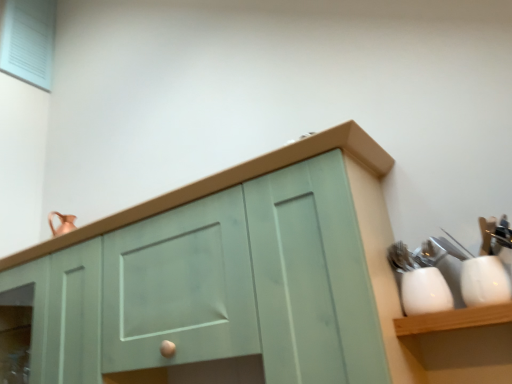
Question: Can you confirm if matte green cabinet at center is taller than white glossy cup at right, which appears as the second tableware when viewed from the right?

Choices:
 (A) no
 (B) yes

Answer: (B)

Question: Is matte green cabinet at center in contact with white glossy cup at right, arranged as the first tableware when viewed from the left?

Choices:
 (A) yes
 (B) no

Answer: (B)

Question: Is matte green cabinet at center far away from white glossy cup at right, which appears as the second tableware when viewed from the right?

Choices:
 (A) yes
 (B) no

Answer: (B)

Question: Is matte green cabinet at center at the right side of white glossy cup at right, arranged as the first tableware when viewed from the left?

Choices:
 (A) no
 (B) yes

Answer: (A)

Question: From the image's perspective, does matte green cabinet at center appear lower than white glossy cup at right, arranged as the first tableware when viewed from the left?

Choices:
 (A) no
 (B) yes

Answer: (B)

Question: From a real-world perspective, is matte green cabinet at center under white glossy cup at right, which appears as the second tableware when viewed from the right?

Choices:
 (A) no
 (B) yes

Answer: (A)

Question: Is white glossy cup at right, which appears as the 1th tableware when viewed from the right, to the right of matte green cabinet at center from the viewer's perspective?

Choices:
 (A) no
 (B) yes

Answer: (B)

Question: Is white glossy cup at right, which appears as the 1th tableware when viewed from the right, smaller than matte green cabinet at center?

Choices:
 (A) no
 (B) yes

Answer: (B)

Question: Is white glossy cup at right, marked as the second tableware in a left-to-right arrangement, positioned beyond the bounds of matte green cabinet at center?

Choices:
 (A) yes
 (B) no

Answer: (A)

Question: Considering the relative sizes of white glossy cup at right, marked as the second tableware in a left-to-right arrangement, and matte green cabinet at center in the image provided, is white glossy cup at right, marked as the second tableware in a left-to-right arrangement, wider than matte green cabinet at center?

Choices:
 (A) no
 (B) yes

Answer: (A)

Question: Is white glossy cup at right, marked as the second tableware in a left-to-right arrangement, thinner than matte green cabinet at center?

Choices:
 (A) yes
 (B) no

Answer: (A)

Question: Are white glossy cup at right, marked as the second tableware in a left-to-right arrangement, and matte green cabinet at center located far from each other?

Choices:
 (A) yes
 (B) no

Answer: (B)

Question: Can you confirm if white glossy cup at right, arranged as the first tableware when viewed from the left, is wider than matte green cabinet at center?

Choices:
 (A) yes
 (B) no

Answer: (B)